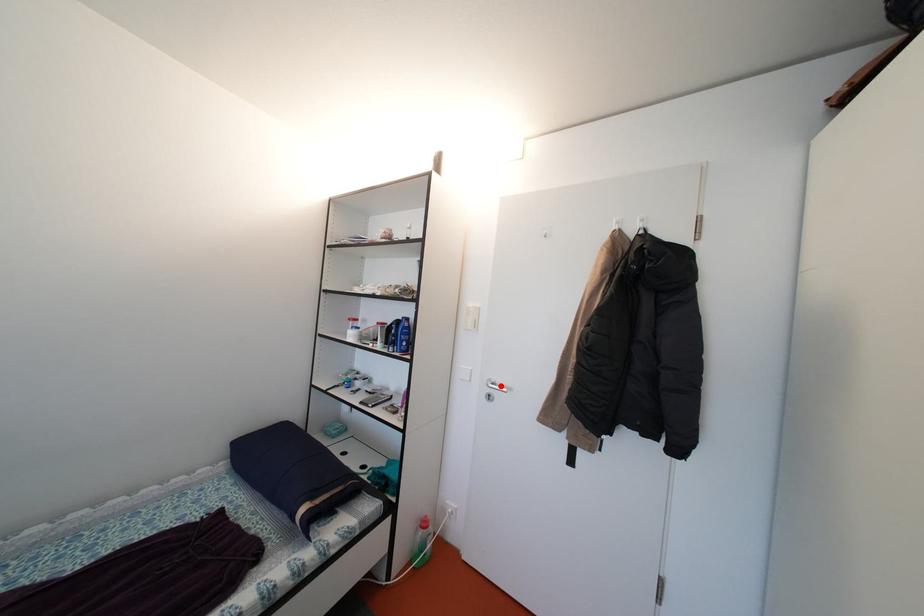
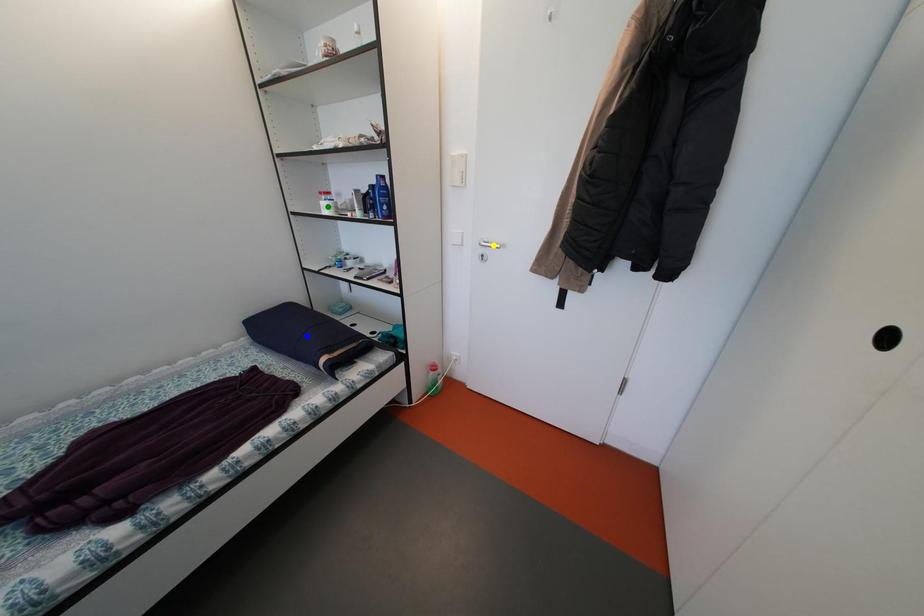
Question: I am providing you with two images of the same scene from different viewpoints. A red point is marked on the first image. You are given multiple points on the second image. In image 2, which mark is for the same physical point as the one in image 1?

Choices:
 (A) yellow point
 (B) green point
 (C) blue point

Answer: (A)